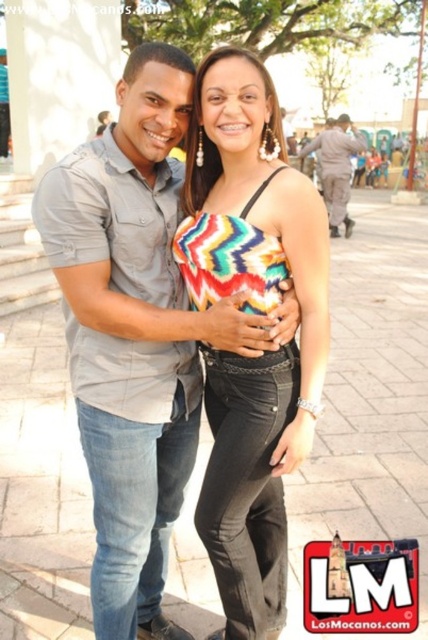
Looking at the scene, where is the multicolored zigzag top at center in relation to the camouflage fabric uniform at right?

The multicolored zigzag top at center is to the left of the camouflage fabric uniform at right.

You are standing in the plaza and want to hand a flower to the person wearing the multicolored zigzag top at center. If your arm can reach 5 feet, will you be able to give them the flower without moving closer?

The multicolored zigzag top at center is 6.19 feet away from you. Since your arm can only reach 5 feet, you cannot reach them without moving closer.

You are a fashion designer observing the image. You need to decide which clothing item is taller between the multicolored zigzag top at center and the camouflage fabric uniform at right. Which one is taller?

The multicolored zigzag top at center has a greater height compared to the camouflage fabric uniform at right, so the multicolored zigzag top at center is taller.